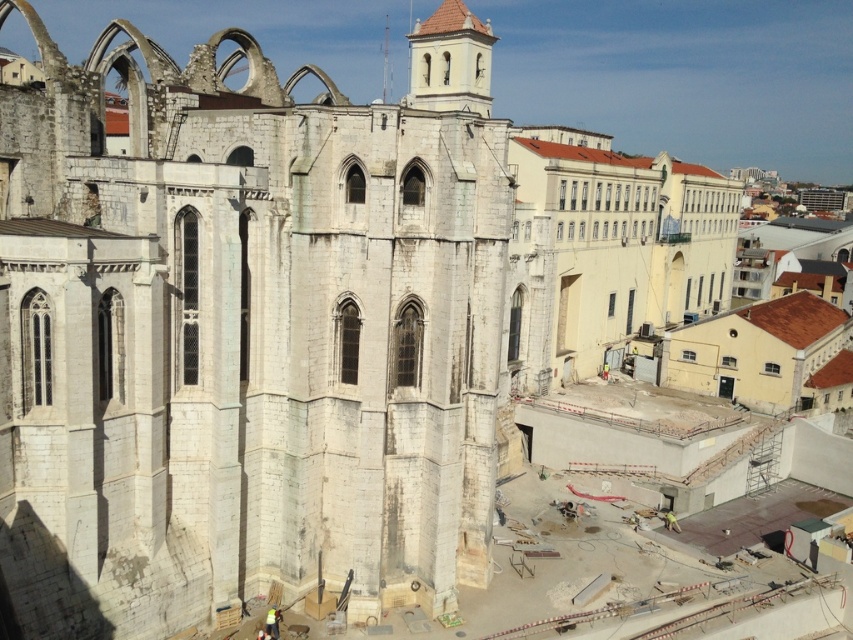
Which is more to the left, white stone ruins at center or smooth beige tower at center?

white stone ruins at center is more to the left.

Does white stone ruins at center come in front of smooth beige tower at center?

Yes, it is in front of smooth beige tower at center.

Identify the location of white stone ruins at center. The width and height of the screenshot is (853, 640). (241, 340).